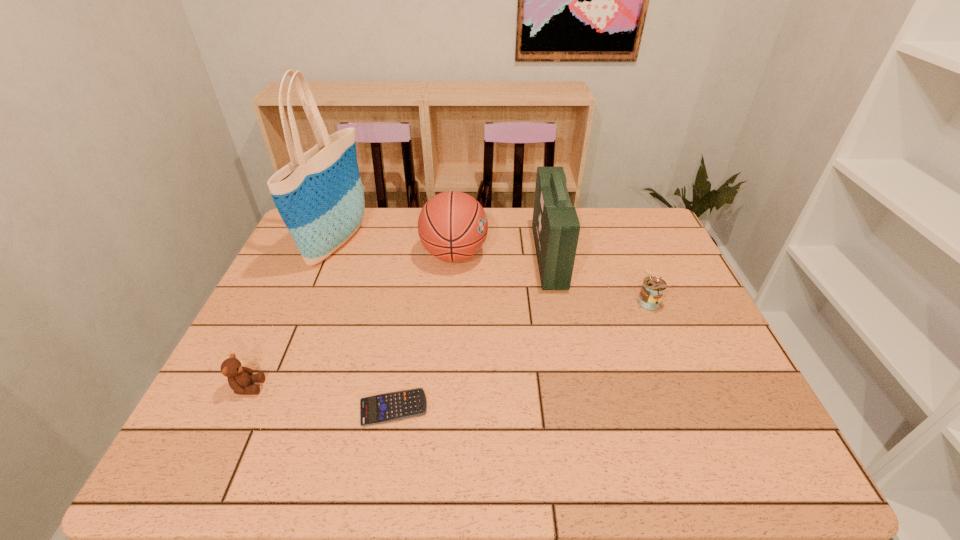
The height and width of the screenshot is (540, 960). What are the coordinates of `empty space that is in between the fifth shortest object and the third nearest object` in the screenshot? It's located at (597, 279).

At what (x,y) coordinates should I click in order to perform the action: click on free space between the tallest object and the fifth tallest object. Please return your answer as a coordinate pair (x, y). The height and width of the screenshot is (540, 960). Looking at the image, I should click on (294, 314).

Locate an element on the screen. vacant space that's between the first-aid kit and the teddy bear is located at coordinates (398, 321).

Locate an element on the screen. The image size is (960, 540). vacant point located between the second shortest object and the calculator is located at coordinates (321, 397).

I want to click on vacant area that lies between the tallest object and the calculator, so click(x=366, y=325).

Locate an element on the screen. This screenshot has width=960, height=540. empty space between the shortest object and the rightmost object is located at coordinates (519, 355).

Identify which object is the second nearest to the fifth object from left to right. Please provide its 2D coordinates. Your answer should be formatted as a tuple, i.e. [(x, y)], where the tuple contains the x and y coordinates of a point satisfying the conditions above.

[(653, 288)]

Find the location of a particular element. Image resolution: width=960 pixels, height=540 pixels. object that stands as the third closest to the can is located at coordinates (393, 406).

At what (x,y) coordinates should I click in order to perform the action: click on vacant space that satisfies the following two spatial constraints: 1. on the front-facing side of the third nearest object; 2. on the right side of the first-aid kit. Please return your answer as a coordinate pair (x, y). The width and height of the screenshot is (960, 540). Looking at the image, I should click on (558, 302).

You are a GUI agent. You are given a task and a screenshot of the screen. Output one action in this format:
    pyautogui.click(x=<x>, y=<y>)
    Task: Click on the free space that satisfies the following two spatial constraints: 1. on the logo side of the basketball; 2. on the back side of the rightmost object
    The image size is (960, 540).
    Given the screenshot: What is the action you would take?
    pyautogui.click(x=451, y=302)